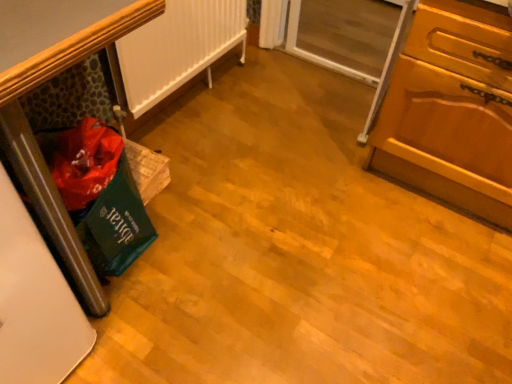
Question: From a real-world perspective, is white matte radiator at left located beneath transparent glass screen door at upper right?

Choices:
 (A) yes
 (B) no

Answer: (B)

Question: Is white matte radiator at left to the right of transparent glass screen door at upper right from the viewer's perspective?

Choices:
 (A) yes
 (B) no

Answer: (B)

Question: Is white matte radiator at left turned away from transparent glass screen door at upper right?

Choices:
 (A) no
 (B) yes

Answer: (A)

Question: Is white matte radiator at left located outside transparent glass screen door at upper right?

Choices:
 (A) no
 (B) yes

Answer: (B)

Question: Are white matte radiator at left and transparent glass screen door at upper right located far from each other?

Choices:
 (A) yes
 (B) no

Answer: (B)

Question: From a real-world perspective, is white matte radiator at left over transparent glass screen door at upper right?

Choices:
 (A) yes
 (B) no

Answer: (A)

Question: From a real-world perspective, is white matte radiator at left on top of wooden cabinet at right?

Choices:
 (A) no
 (B) yes

Answer: (A)

Question: Considering the relative sizes of white matte radiator at left and wooden cabinet at right in the image provided, is white matte radiator at left wider than wooden cabinet at right?

Choices:
 (A) yes
 (B) no

Answer: (B)

Question: Is wooden cabinet at right at the back of white matte radiator at left?

Choices:
 (A) yes
 (B) no

Answer: (B)

Question: Does white matte radiator at left come behind wooden cabinet at right?

Choices:
 (A) no
 (B) yes

Answer: (B)

Question: Considering the relative sizes of white matte radiator at left and wooden cabinet at right in the image provided, is white matte radiator at left smaller than wooden cabinet at right?

Choices:
 (A) no
 (B) yes

Answer: (B)

Question: Does white matte radiator at left touch wooden cabinet at right?

Choices:
 (A) yes
 (B) no

Answer: (B)

Question: From a real-world perspective, does wooden cabinet at right stand above green fabric bag at left?

Choices:
 (A) yes
 (B) no

Answer: (A)